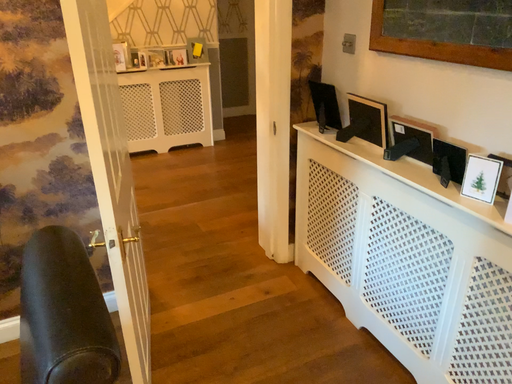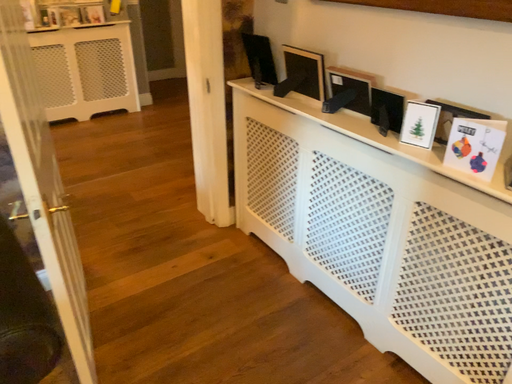
Question: Which way did the camera rotate in the video?

Choices:
 (A) rotated right
 (B) rotated left

Answer: (A)